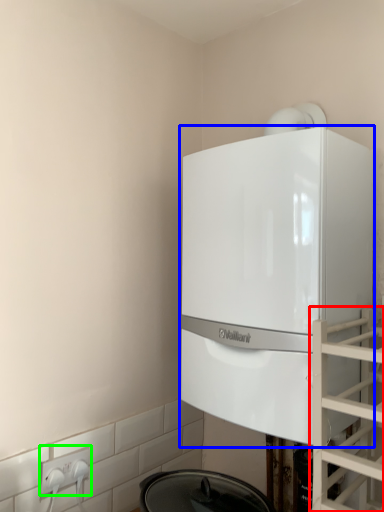
Question: Which object is positioned farthest from glass door (highlighted by a red box)? Select from home appliance (highlighted by a blue box) and electric outlet (highlighted by a green box).

Choices:
 (A) home appliance
 (B) electric outlet

Answer: (B)